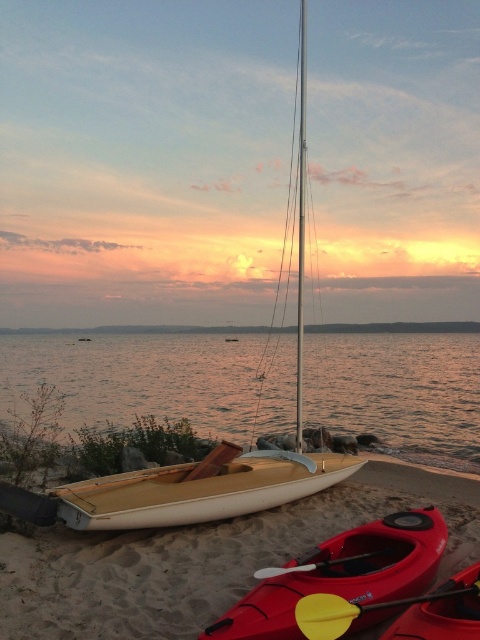
You are a photographer planning to take a photo of the wooden sailboat at center and the matte red canoe at lower right. Since you want to ensure both are fully visible in the frame, which object should you position closer to the camera to avoid cropping?

The wooden sailboat at center is taller than the matte red canoe at lower right, so you should position the wooden sailboat at center closer to the camera to ensure its full height fits within the frame without cropping.

You are planning to walk from the left edge of the image to the right edge. You can only step on the smooth water at center or the beige sand at center. Which path is wider and safer for walking?

The smooth water at center is wider than the beige sand at center, so it is safer to walk on the smooth water at center.